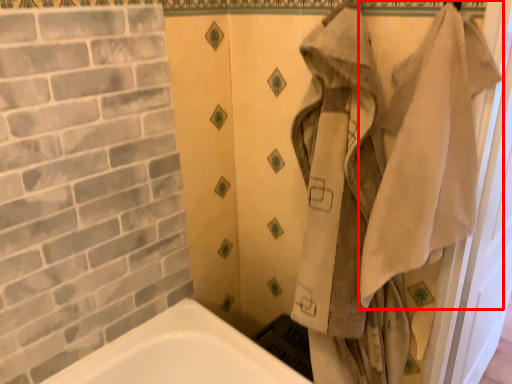
Question: Where is bath towel (annotated by the red box) located in relation to screen door in the image?

Choices:
 (A) right
 (B) left

Answer: (B)